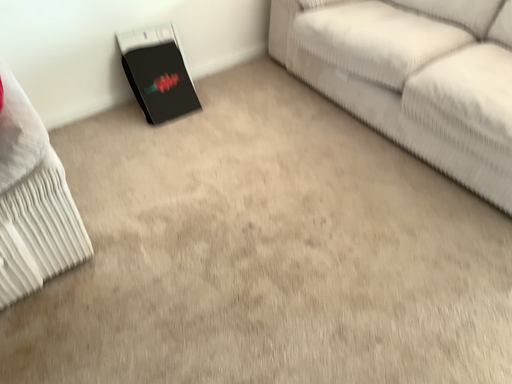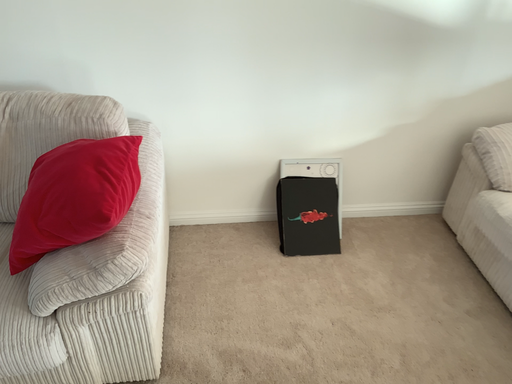
Question: How did the camera likely rotate when shooting the video?

Choices:
 (A) rotated downward
 (B) rotated upward

Answer: (B)